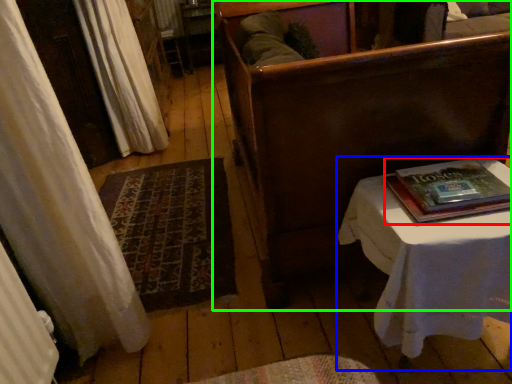
Question: Which object is positioned closest to paperback book (highlighted by a red box)? Select from table (highlighted by a blue box) and furniture (highlighted by a green box).

Choices:
 (A) table
 (B) furniture

Answer: (A)